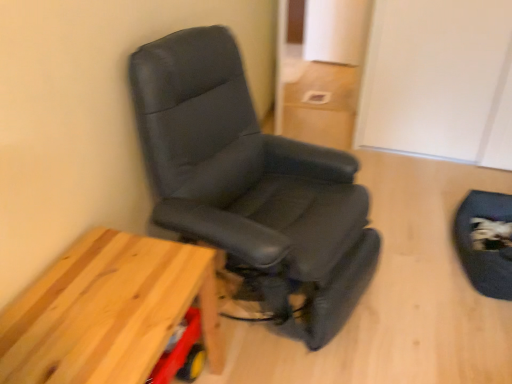
This screenshot has width=512, height=384. Find the location of `vacant area that lies to the right of black leather chair at left`. vacant area that lies to the right of black leather chair at left is located at coordinates (420, 273).